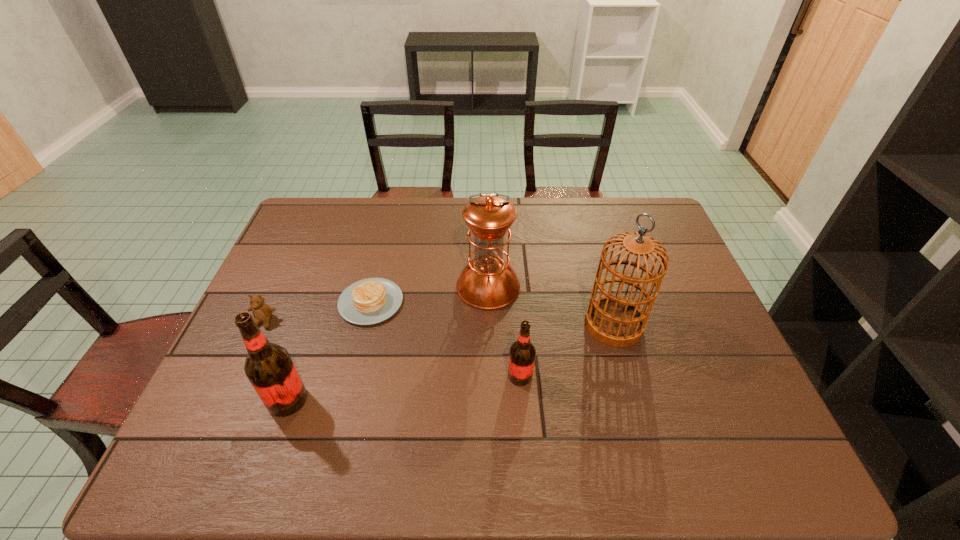
Where is `unoccupied area between the right root beer and the rightmost object`? The image size is (960, 540). unoccupied area between the right root beer and the rightmost object is located at coordinates (567, 350).

This screenshot has width=960, height=540. What are the coordinates of `free spot between the oil lamp and the fourth object from right to left` in the screenshot? It's located at (429, 294).

The width and height of the screenshot is (960, 540). Find the location of `blank region between the birdcage and the shorter root beer`. blank region between the birdcage and the shorter root beer is located at coordinates (567, 350).

At what (x,y) coordinates should I click in order to perform the action: click on empty space that is in between the shortest object and the oil lamp. Please return your answer as a coordinate pair (x, y). Image resolution: width=960 pixels, height=540 pixels. Looking at the image, I should click on (429, 294).

Find the location of `vacant space that's between the birdcage and the fifth object from right to left`. vacant space that's between the birdcage and the fifth object from right to left is located at coordinates (450, 362).

The width and height of the screenshot is (960, 540). Identify the location of empty space that is in between the oil lamp and the shortest object. (429, 294).

Where is `the second closest object to the right root beer`? The height and width of the screenshot is (540, 960). the second closest object to the right root beer is located at coordinates (488, 282).

Where is `object that ranks as the third closest to the pancake`? The width and height of the screenshot is (960, 540). object that ranks as the third closest to the pancake is located at coordinates (268, 366).

Image resolution: width=960 pixels, height=540 pixels. In order to click on vacant space that satisfies the following two spatial constraints: 1. on the front-facing side of the taller root beer; 2. on the left side of the leftmost object in this screenshot , I will do pyautogui.click(x=228, y=400).

The height and width of the screenshot is (540, 960). What are the coordinates of `blank space that satisfies the following two spatial constraints: 1. on the back side of the birdcage; 2. on the left side of the second object from left to right` in the screenshot? It's located at (314, 324).